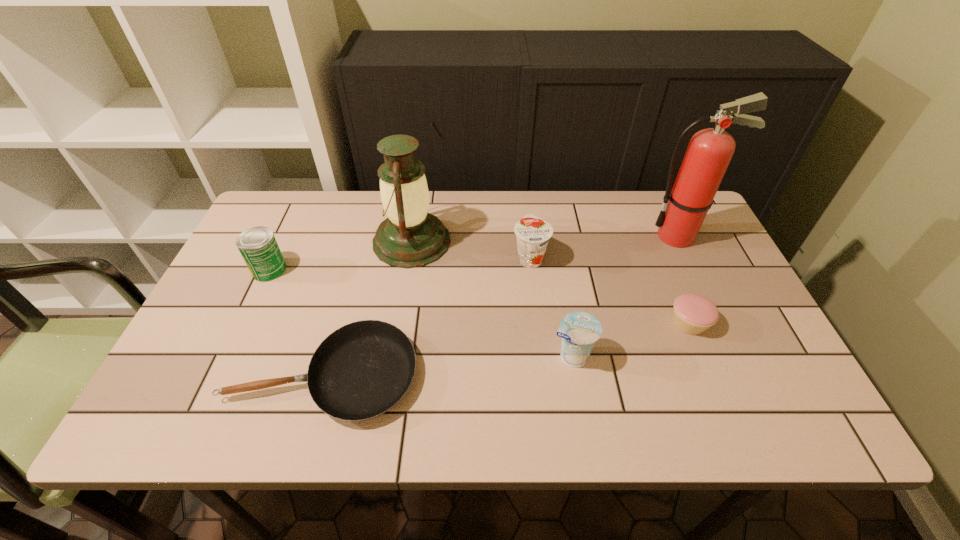
I want to click on vacant space situated 0.320m with the light compartment facing forward on the second tallest object, so click(x=562, y=241).

Image resolution: width=960 pixels, height=540 pixels. In order to click on vacant area located on the right of the can in this screenshot , I will do `click(356, 269)`.

The height and width of the screenshot is (540, 960). What are the coordinates of `free region located on the front of the farther yogurt` in the screenshot? It's located at (538, 323).

Find the location of a particular element. This screenshot has width=960, height=540. vacant space located 0.390m on the right of the nearer yogurt is located at coordinates (765, 356).

Find the location of a particular element. The height and width of the screenshot is (540, 960). blank area located 0.110m on the back of the sixth tallest object is located at coordinates (669, 275).

This screenshot has height=540, width=960. Find the location of `free space located on the right of the frying pan`. free space located on the right of the frying pan is located at coordinates (582, 375).

Find the location of a particular element. fire extinguisher that is at the far edge is located at coordinates (709, 152).

Locate an element on the screen. This screenshot has height=540, width=960. lantern located at the far edge is located at coordinates (410, 237).

Locate an element on the screen. The image size is (960, 540). object that is at the near edge is located at coordinates (361, 370).

Where is `can at the left edge`? Image resolution: width=960 pixels, height=540 pixels. can at the left edge is located at coordinates (258, 246).